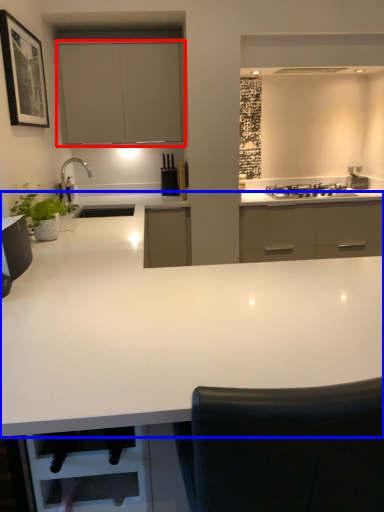
Question: Which object appears farthest to the camera in this image, cabinetry (highlighted by a red box) or countertop (highlighted by a blue box)?

Choices:
 (A) cabinetry
 (B) countertop

Answer: (A)